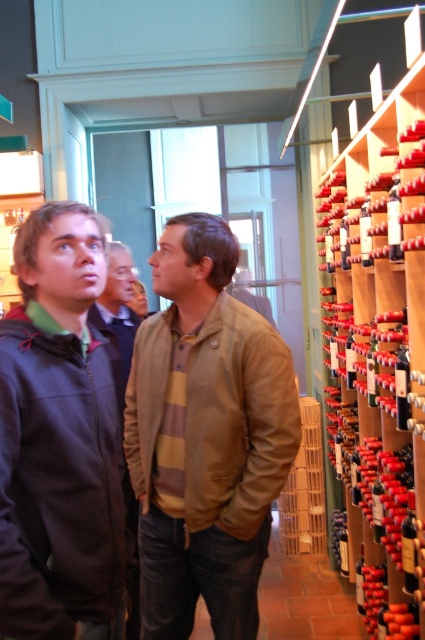
You are organizing a wine tasting event and need to place a decorative centerpiece on the table. The brown leather jacket at center and the wooden at right are both in the room. Which object should you choose to place the centerpiece on to ensure it has enough space?

The wooden at right should be chosen because it occupies more space than the brown leather jacket at center, providing a larger surface area for the centerpiece.

You are standing at the entrance of the wine cellar and see two points marked in the image. Which point is closer to you, point (96, 451) or point (401, 561)?

Point (96, 451) is in front of point (401, 561), so it is closer to you.

You are standing in the wine cellar and want to place a new wine bottle at the point labeled as point (379, 346). Based on the scene description, where exactly would this point be located?

The point (379, 346) corresponds to the wooden shelves at the right side of the scene.